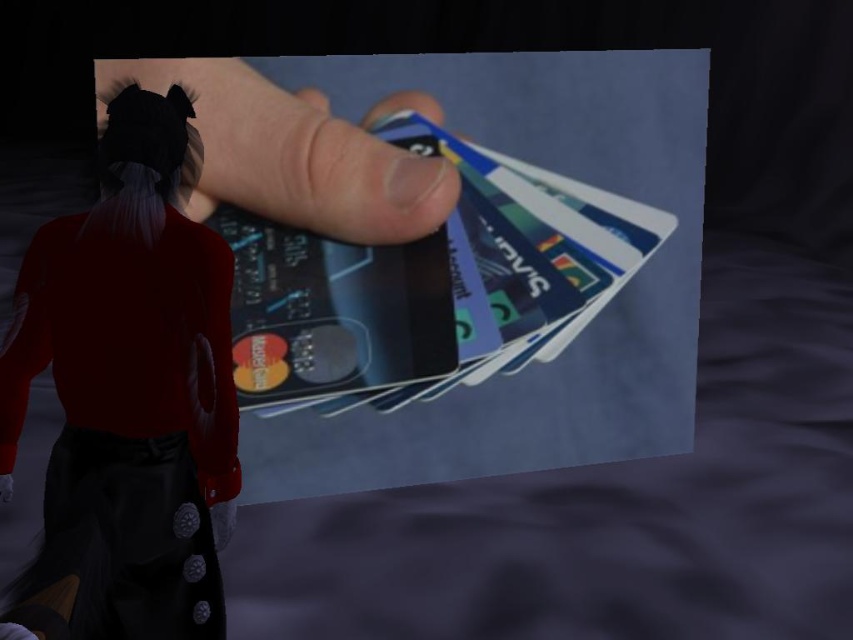
Question: Among these points, which one is farthest from the camera?

Choices:
 (A) (248, 188)
 (B) (572, 225)
 (C) (201, 252)

Answer: (B)

Question: Can you confirm if smooth skin hand at center is positioned to the left of metallic blue credit card at center?

Choices:
 (A) no
 (B) yes

Answer: (B)

Question: Is silky black hair at upper left smaller than smooth skin hand at center?

Choices:
 (A) no
 (B) yes

Answer: (A)

Question: Which object is positioned farthest from the silky black hair at upper left?

Choices:
 (A) metallic blue credit card at center
 (B) smooth skin hand at center

Answer: (A)

Question: Does silky black hair at upper left have a lesser width compared to metallic blue credit card at center?

Choices:
 (A) yes
 (B) no

Answer: (A)

Question: Which is nearer to the silky black hair at upper left?

Choices:
 (A) metallic blue credit card at center
 (B) smooth skin hand at center

Answer: (B)